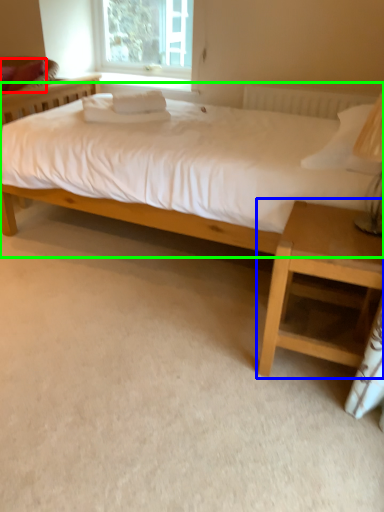
Question: Estimate the real-world distances between objects in this image. Which object is farther from pillow (highlighted by a red box), nightstand (highlighted by a blue box) or bed (highlighted by a green box)?

Choices:
 (A) nightstand
 (B) bed

Answer: (A)